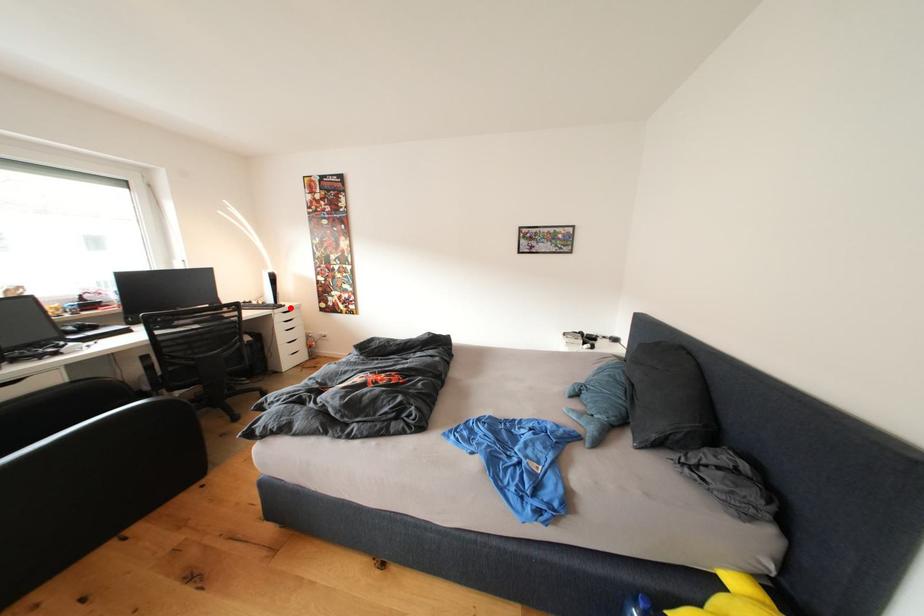
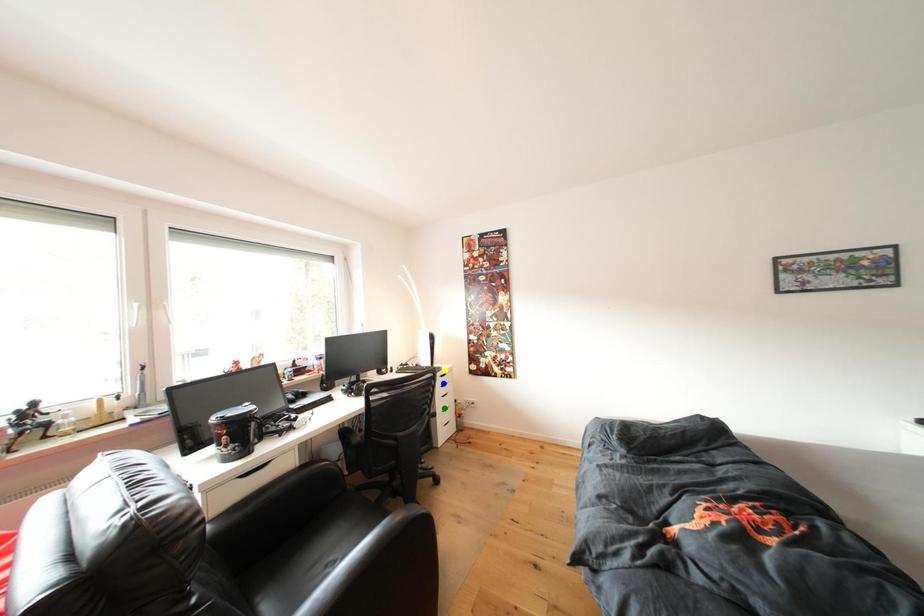
Question: I am providing you with two images of the same scene from different viewpoints. A red point is marked on the first image. You are given multiple points on the second image. Which spot in image 2 lines up with the point in image 1?

Choices:
 (A) blue point
 (B) green point
 (C) yellow point

Answer: (C)